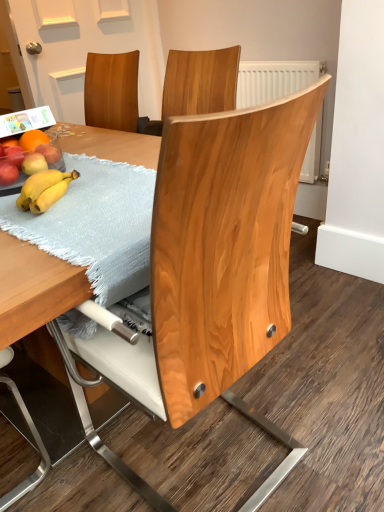
Find the location of a particular element. vacant space to the right of matte red apple at left, arranged as the 3th apple when viewed from the front is located at coordinates (90, 166).